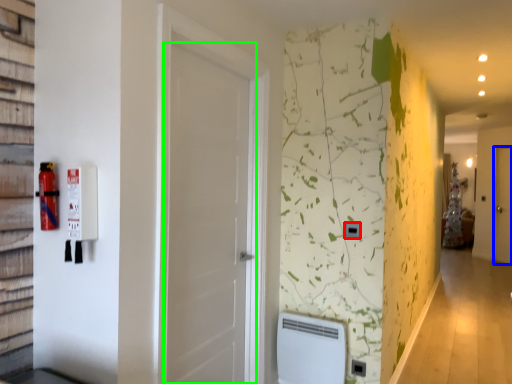
Question: Which object is the farthest from light switch (highlighted by a red box)? Choose among these: door (highlighted by a blue box) or door (highlighted by a green box).

Choices:
 (A) door
 (B) door

Answer: (A)